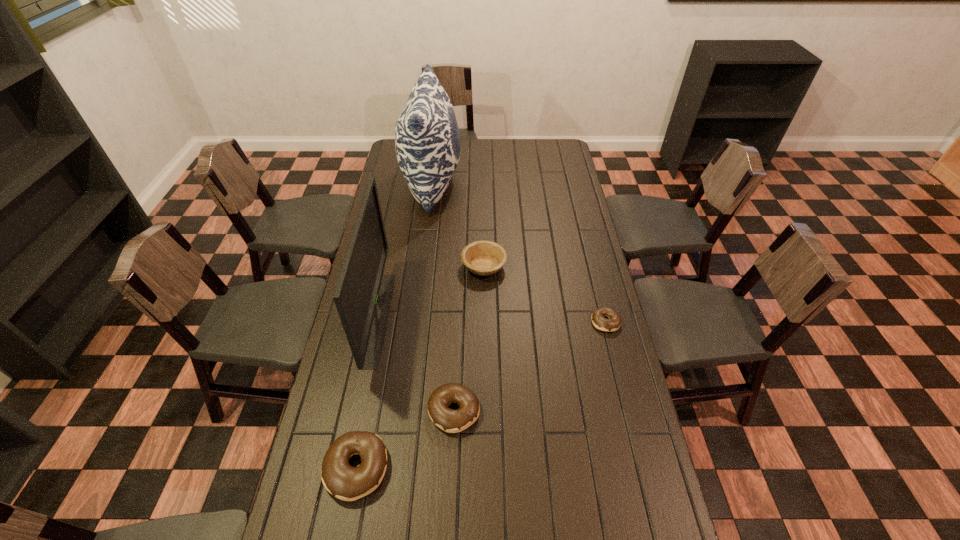
To make them evenly spaced by inserting another doughnut among them, please locate a free space for this new doughnut. Please provide its 2D coordinates. Your answer should be formatted as a tuple, i.e. [(x, y)], where the tuple contains the x and y coordinates of a point satisfying the conditions above.

[(536, 363)]